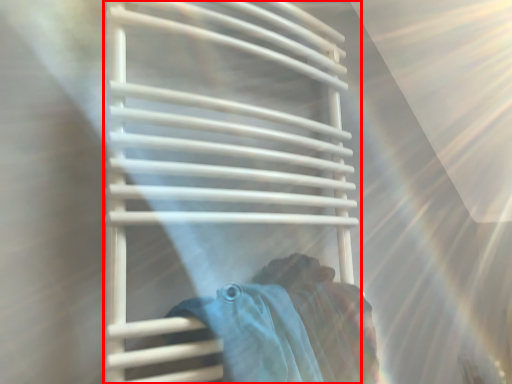
Question: From the image's perspective, what is the correct spatial positioning of towel rack (annotated by the red box) in reference to woman?

Choices:
 (A) above
 (B) below

Answer: (A)